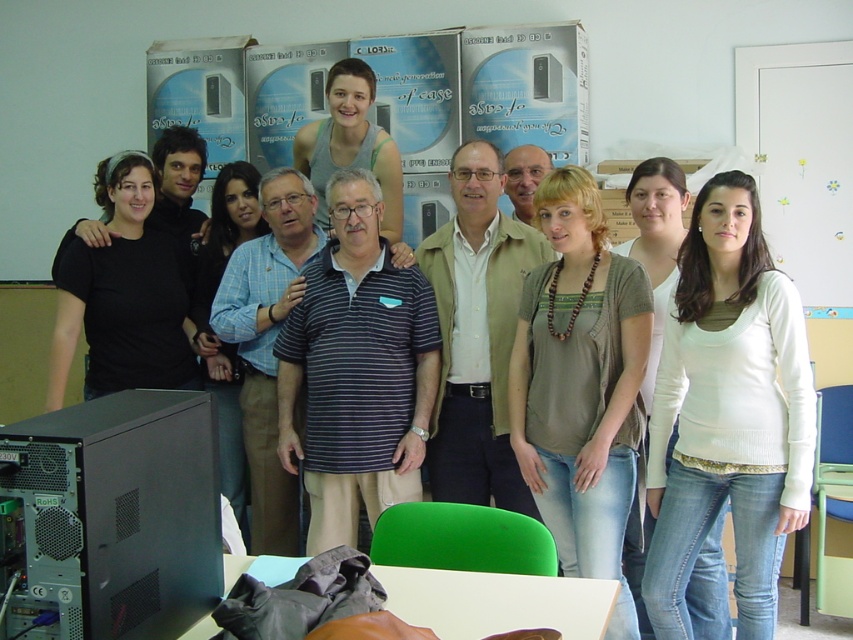
You are a photographer adjusting your camera settings. You notice the black matte computer at lower left and the blue plaid shirt at center in your frame. Which object is positioned more to the left side of the image?

The blue plaid shirt at center is positioned more to the left side of the image because the black matte computer at lower left is to the right of the blue plaid shirt at center.

You are a photographer adjusting your camera settings to focus on the white soft sweater at center and the black matte computer at lower left. Which object should you focus on first to ensure both are in focus without moving the camera?

You should focus on the white soft sweater at center first because it is closer to you than the black matte computer at lower left. By focusing on the closer object, the farther one may still be within the depth of field, ensuring both are in focus without moving the camera.